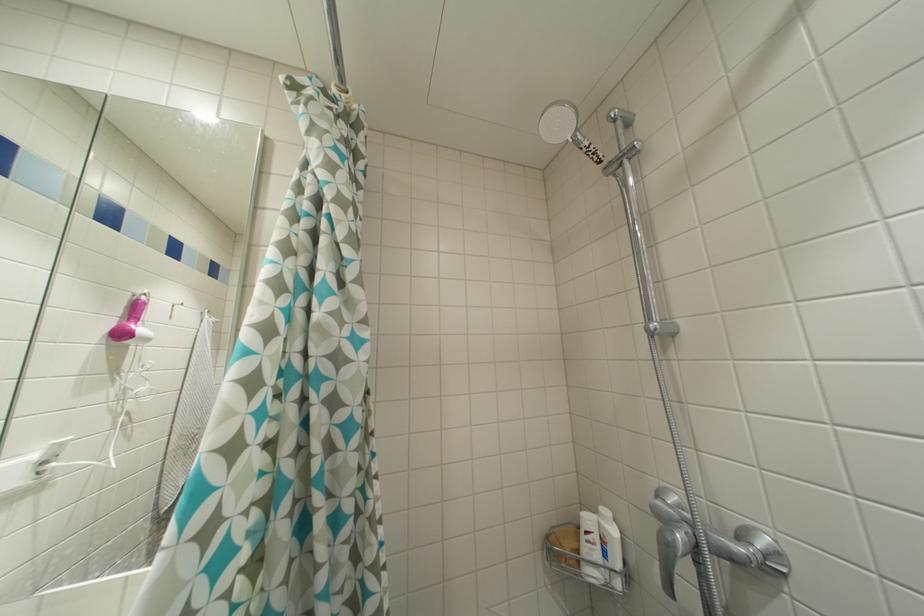
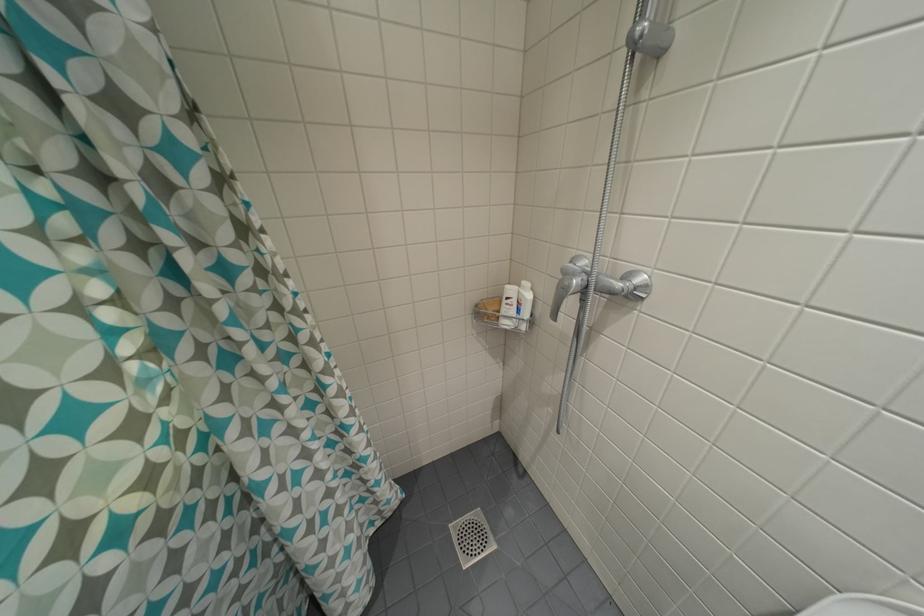
Question: How did the camera likely rotate?

Choices:
 (A) Left
 (B) Right
 (C) Up
 (D) Down

Answer: (D)